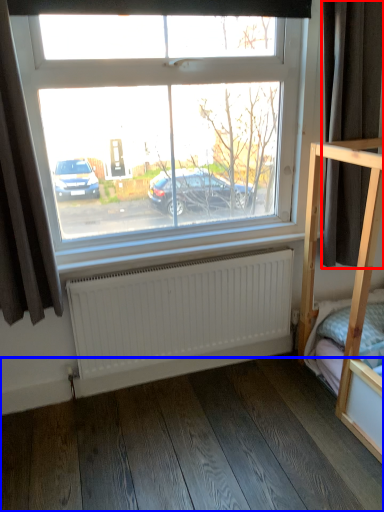
Question: Among these objects, which one is nearest to the camera, curtain (highlighted by a red box) or hardwood (highlighted by a blue box)?

Choices:
 (A) curtain
 (B) hardwood

Answer: (B)